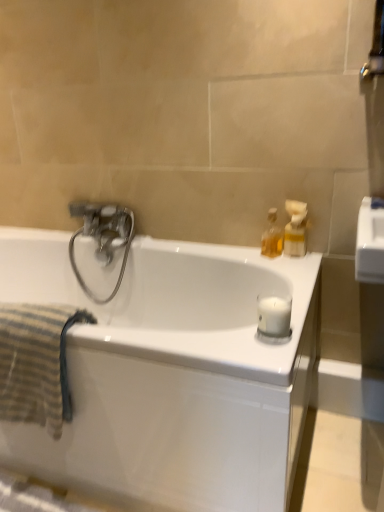
You are a GUI agent. You are given a task and a screenshot of the screen. Output one action in this format:
    pyautogui.click(x=<x>, y=<y>)
    Task: Click on the free spot to the left of white matte candle at right
    Image resolution: width=384 pixels, height=512 pixels.
    Given the screenshot: What is the action you would take?
    pyautogui.click(x=220, y=343)